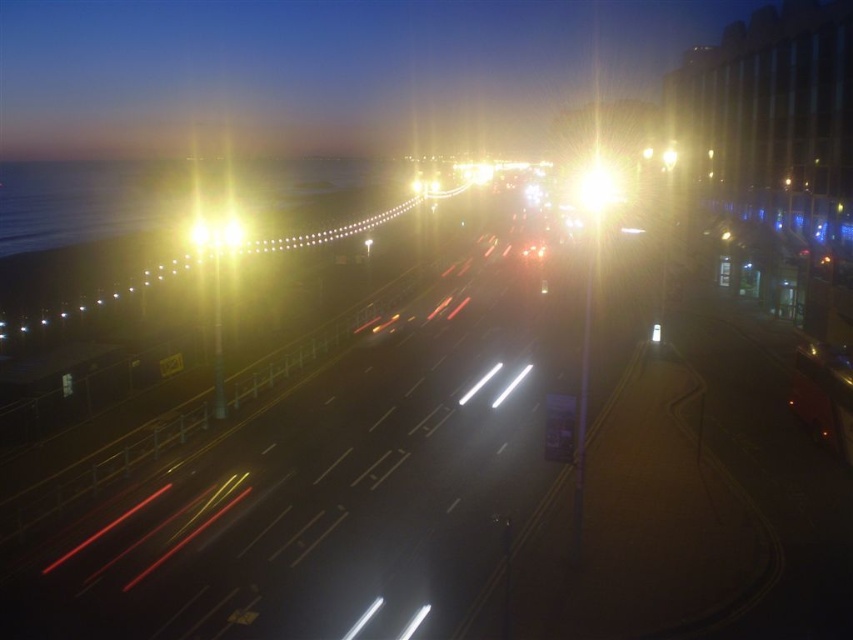
Question: Does bright metallic streetlight at center appear under bright yellow light at center?

Choices:
 (A) yes
 (B) no

Answer: (B)

Question: Which object is farther from the camera taking this photo?

Choices:
 (A) bright metallic streetlight at center
 (B) bright yellow light at center
 (C) metallic orange car at lower right

Answer: (A)

Question: Does bright metallic streetlight at center appear on the left side of bright yellow light at center?

Choices:
 (A) no
 (B) yes

Answer: (A)

Question: Which object appears closest to the camera in this image?

Choices:
 (A) bright metallic streetlight at center
 (B) metallic orange car at lower right
 (C) bright yellow light at center

Answer: (B)

Question: Can you confirm if bright metallic streetlight at center is positioned below bright yellow light at center?

Choices:
 (A) yes
 (B) no

Answer: (B)

Question: Which of the following is the closest to the observer?

Choices:
 (A) (822, 410)
 (B) (595, 168)
 (C) (202, 250)

Answer: (A)